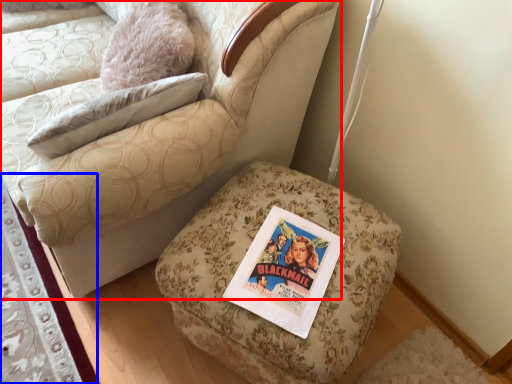
Question: Which point is further to the camera, chair (highlighted by a red box) or mat (highlighted by a blue box)?

Choices:
 (A) chair
 (B) mat

Answer: (B)